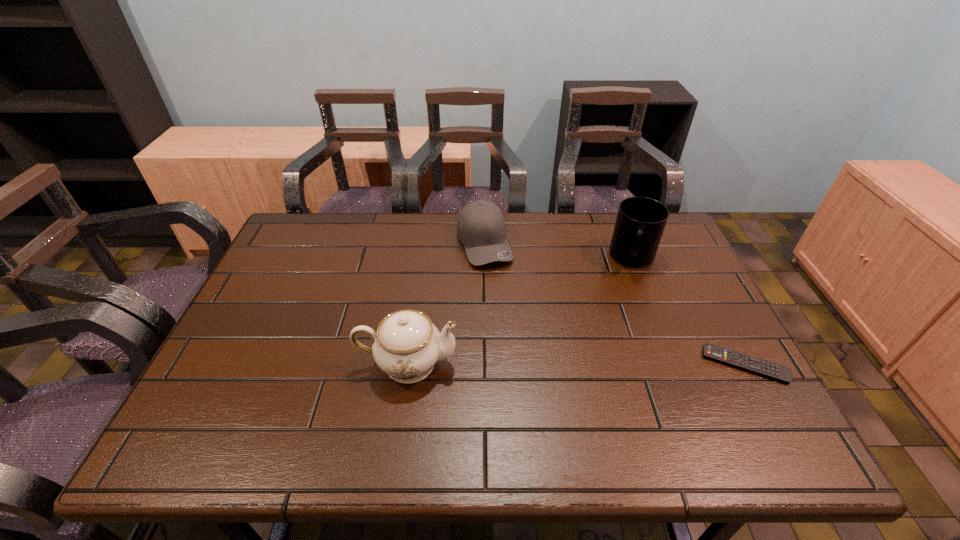
Where is `free space between the chinaware and the third tallest object`? free space between the chinaware and the third tallest object is located at coordinates (446, 303).

Locate an element on the screen. free space between the rightmost object and the third object from left to right is located at coordinates (688, 311).

The height and width of the screenshot is (540, 960). Identify the location of empty location between the chinaware and the mug. (520, 311).

This screenshot has width=960, height=540. I want to click on vacant area between the second object from right to left and the chinaware, so click(x=520, y=311).

Locate an element on the screen. The image size is (960, 540). free space between the chinaware and the third tallest object is located at coordinates (446, 303).

At what (x,y) coordinates should I click in order to perform the action: click on vacant point located between the third tallest object and the chinaware. Please return your answer as a coordinate pair (x, y). The image size is (960, 540). Looking at the image, I should click on (446, 303).

Find the location of a particular element. This screenshot has height=540, width=960. the closest object to the third tallest object is located at coordinates (407, 345).

Locate an element on the screen. the second closest object to the baseball cap is located at coordinates (640, 222).

The image size is (960, 540). Identify the location of vacant space that satisfies the following two spatial constraints: 1. on the front side of the third object from left to right; 2. on the right side of the second shortest object. (484, 258).

Identify the location of vacant space that satisfies the following two spatial constraints: 1. on the front side of the baseball cap; 2. on the right side of the mug. (484, 258).